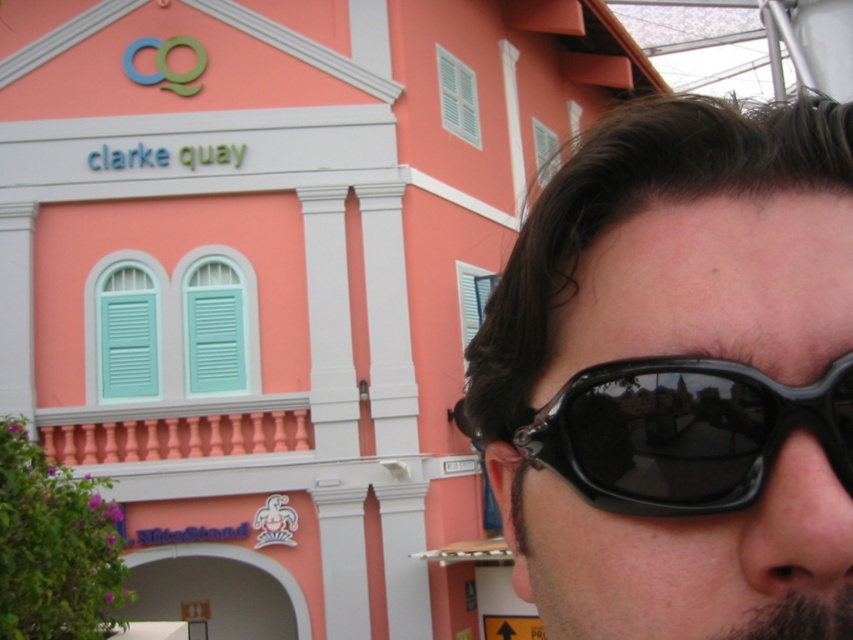
Between black plastic sunglasses at upper right and black plastic goggles at right, which one is positioned lower?

black plastic goggles at right is below.

Locate an element on the screen. This screenshot has height=640, width=853. black plastic sunglasses at upper right is located at coordinates (679, 376).